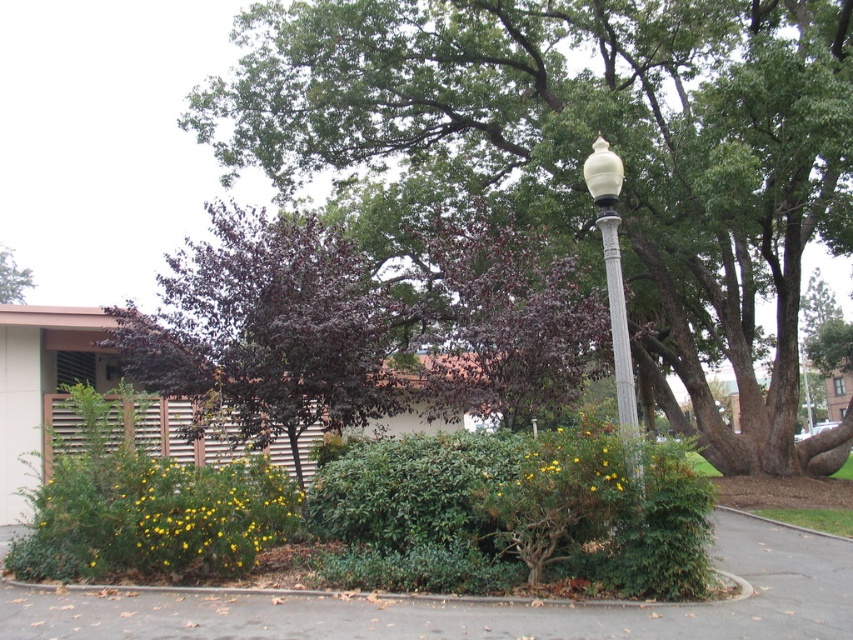
Question: Is purple-leaved tree at center above green leafy bush at center?

Choices:
 (A) no
 (B) yes

Answer: (B)

Question: Does green leafy bush at center appear over green leafy tree at upper left?

Choices:
 (A) no
 (B) yes

Answer: (A)

Question: Which object is positioned closest to the green leafy bush at center?

Choices:
 (A) green leafy tree at upper left
 (B) white glossy pole at center
 (C) purple glossy tree at center

Answer: (C)

Question: Which point is closer to the camera?

Choices:
 (A) (563, 547)
 (B) (238, 394)
 (C) (28, 282)

Answer: (A)

Question: Which object appears farthest from the camera in this image?

Choices:
 (A) green leafy tree at upper left
 (B) purple glossy tree at center
 (C) green leafy bush at center

Answer: (A)

Question: Does purple glossy tree at center appear over green leafy tree at upper left?

Choices:
 (A) yes
 (B) no

Answer: (B)